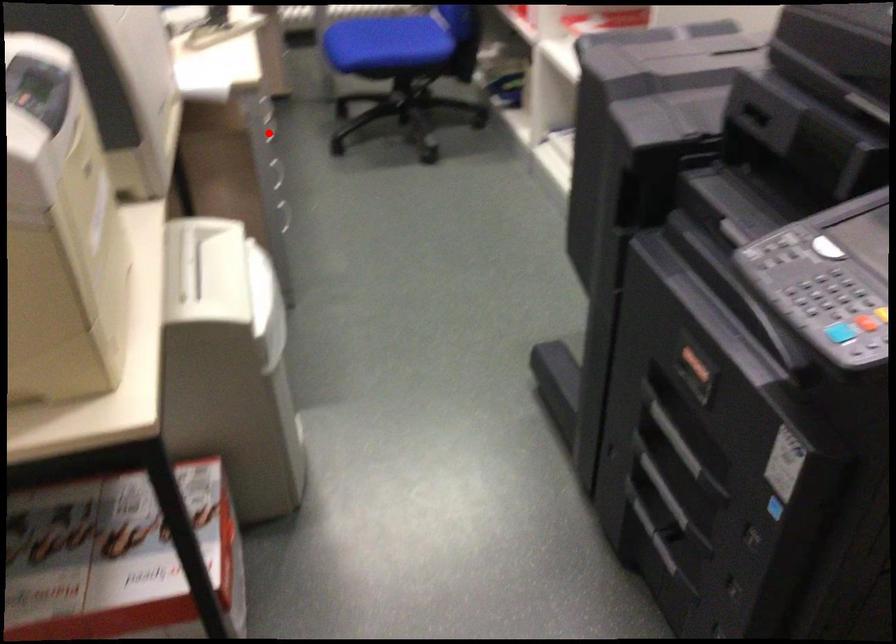
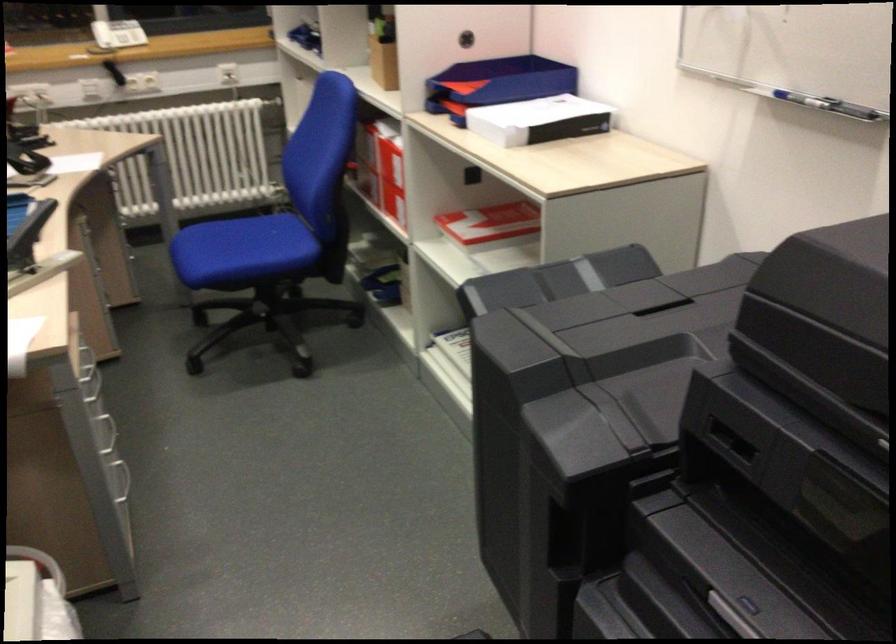
Find the pixel in the second image that matches the highlighted location in the first image.

(92, 386)